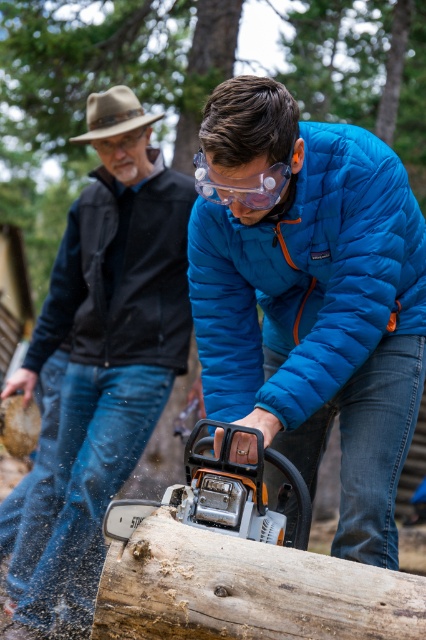
You are a photographer trying to capture a closeup of the blue quilted jacket at center. The camera you are using has a maximum focus range of 8 feet. Can you take the photo without moving closer?

The blue quilted jacket at center and camera are 8.03 feet apart from each other. Since the camera has a maximum focus range of 8 feet, you need to move slightly closer to ensure the jacket is in focus.

You are standing at point (x=112, y=544) and want to walk to point (x=6, y=544). Is the direction you need to move towards forward or backward?

The direction you need to move is forward because point (x=6, y=544) is behind point (x=112, y=544), so moving towards it would be forward.